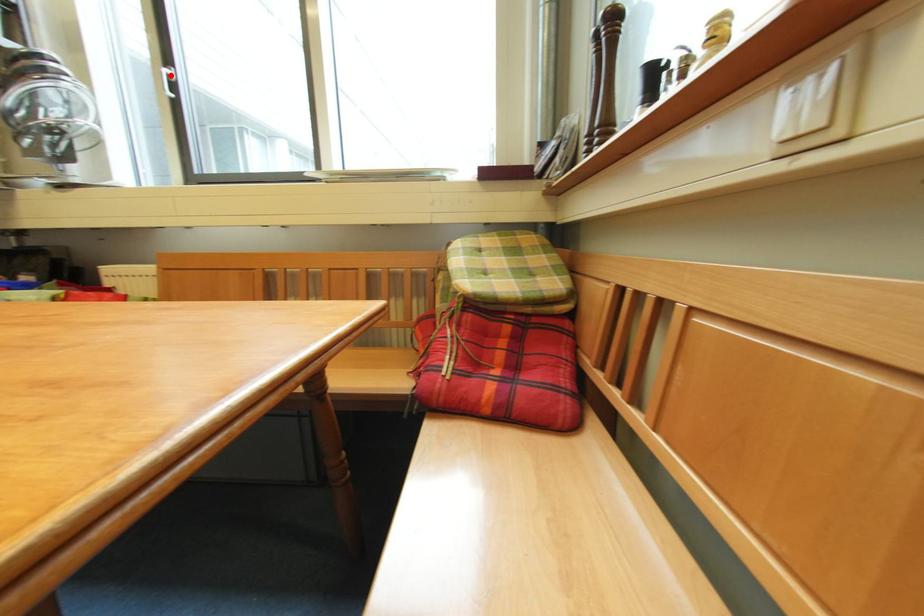
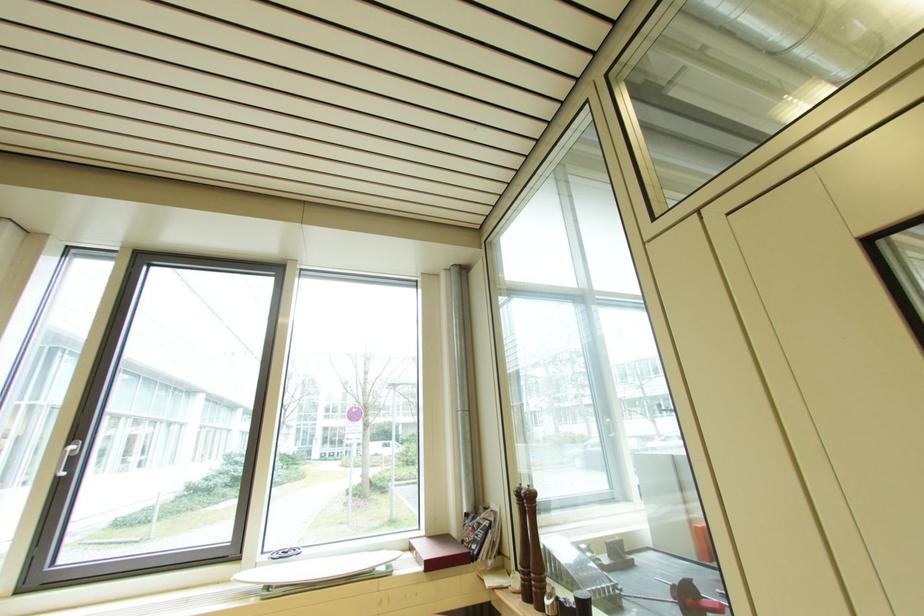
Question: I am providing you with two images of the same scene from different viewpoints. In image1, a red point is highlighted. Considering the same 3D point in image2, which of the following is correct?

Choices:
 (A) It is closer
 (B) It is farther

Answer: (A)